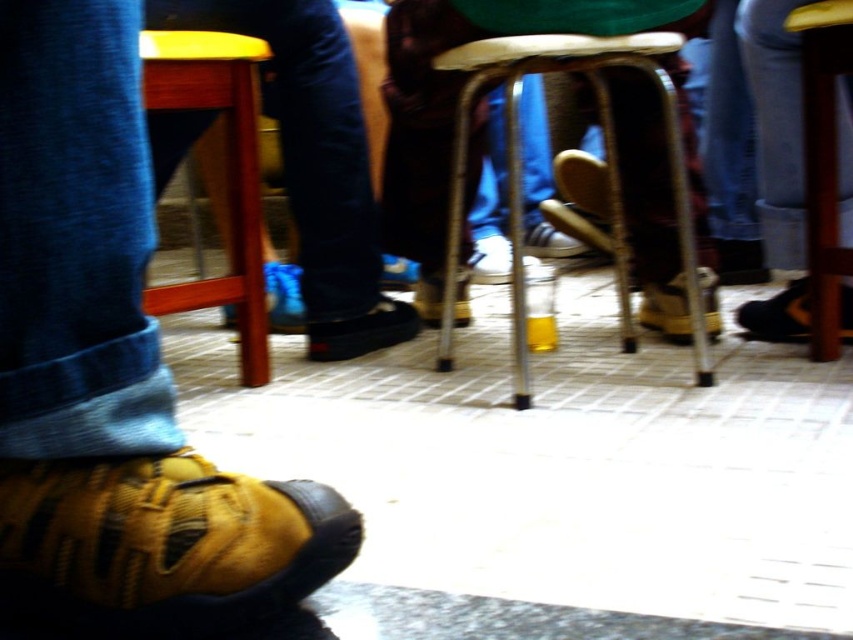
Question: Is leather shoe at lower left to the left of leather at center from the viewer's perspective?

Choices:
 (A) no
 (B) yes

Answer: (B)

Question: Which point is farther to the camera?

Choices:
 (A) blue suede shoe at center
 (B) wooden bar stool at right
 (C) blue suede sneakers at left
 (D) black leather shoe at center

Answer: (A)

Question: Is leather shoe at lower left positioned in front of wooden bar stool at right?

Choices:
 (A) yes
 (B) no

Answer: (A)

Question: Which of the following is the closest to the observer?

Choices:
 (A) [456, 312]
 (B) [323, 346]

Answer: (B)

Question: Does blue suede sneakers at left appear over metallic silver bar stool at center?

Choices:
 (A) no
 (B) yes

Answer: (B)

Question: Considering the real-world distances, which object is farthest from the wooden bar stool at lower left?

Choices:
 (A) black leather shoe at center
 (B) black leather shoe at lower right
 (C) blue suede shoe at center

Answer: (B)